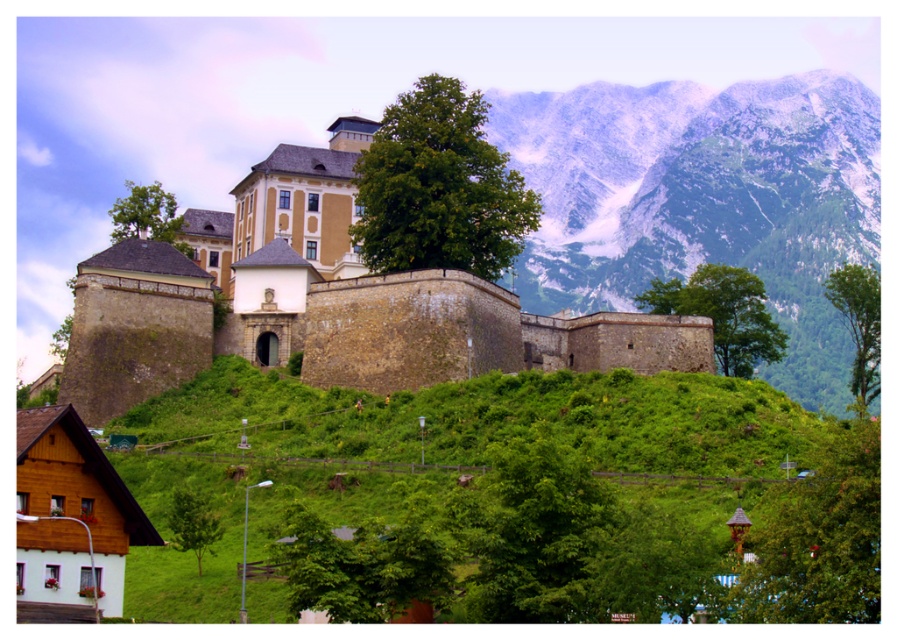
You are standing in front of the fortress and want to take a photo that includes both the wooden house and the fortress. The wooden house is located at point (448, 305) and the fortress is at point (842, 288). Which point should you focus on to ensure both are in focus?

You should focus on point (842, 288) because it is farther away from the camera than point (448, 305), ensuring both are within the depth of field.